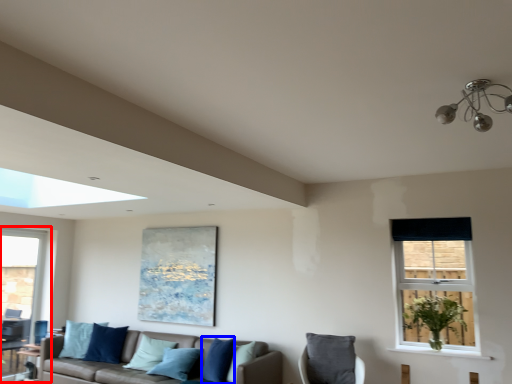
Question: Which of the following is the closest to the observer, window (highlighted by a red box) or pillow (highlighted by a blue box)?

Choices:
 (A) window
 (B) pillow

Answer: (B)